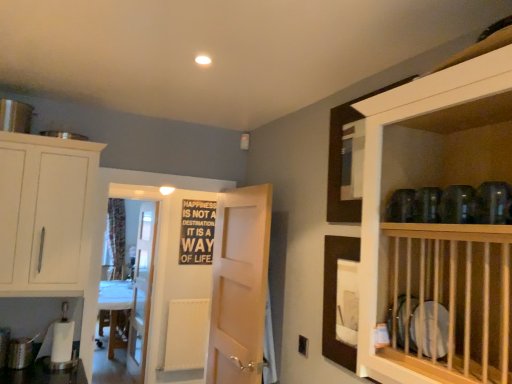
The height and width of the screenshot is (384, 512). In order to click on black matte sign at center in this screenshot , I will do `click(197, 232)`.

What do you see at coordinates (142, 290) in the screenshot?
I see `white wooden door at center, acting as the first door starting from the back` at bounding box center [142, 290].

I want to click on floral fabric curtain at left, so [x=117, y=235].

Describe the element at coordinates (117, 311) in the screenshot. I see `white glossy table at center` at that location.

Describe the element at coordinates (239, 285) in the screenshot. This screenshot has height=384, width=512. I see `white wooden door at center, which is the second door from left to right` at that location.

You are a GUI agent. You are given a task and a screenshot of the screen. Output one action in this format:
    pyautogui.click(x=<x>, y=<y>)
    Task: Click on the black matte sign at center
    The image size is (512, 384).
    Given the screenshot: What is the action you would take?
    pyautogui.click(x=197, y=232)

Are white glossy table at center and white wooden door at center, the first door when ordered from front to back, located far from each other?

That's right, there is a large distance between white glossy table at center and white wooden door at center, the first door when ordered from front to back.

From the image's perspective, is white glossy table at center on top of white wooden door at center, which appears as the first door when viewed from the right?

Incorrect, from the image's perspective, white glossy table at center is lower than white wooden door at center, which appears as the first door when viewed from the right.

Considering the relative sizes of white glossy table at center and white wooden door at center, which appears as the first door when viewed from the right, in the image provided, is white glossy table at center wider than white wooden door at center, which appears as the first door when viewed from the right,?

Yes.

Looking at this image, does white glossy table at center turn towards white wooden door at center, which is the second door from left to right?

No, white glossy table at center is not facing towards white wooden door at center, which is the second door from left to right.

Is white wooden door at center, which is the second door from left to right, touching floral fabric curtain at left?

They are not placed beside each other.

From a real-world perspective, is white wooden door at center, the first door when ordered from front to back, above or below floral fabric curtain at left?

white wooden door at center, the first door when ordered from front to back, is below floral fabric curtain at left.

Is point (240, 250) behind point (120, 254)?

No, it is in front of (120, 254).

Is white glossy table at center touching black matte sign at center?

No.

What's the angular difference between white glossy table at center and black matte sign at center's facing directions?

They differ by 90.9 degrees in their facing directions.

Considering the relative positions of white glossy table at center and black matte sign at center in the image provided, is white glossy table at center to the right of black matte sign at center from the viewer's perspective?

In fact, white glossy table at center is to the left of black matte sign at center.

Who is bigger, white glossy table at center or black matte sign at center?

white glossy table at center.

Could white glossy table at center be considered to be inside white wood cabinet at left?

That's incorrect, white glossy table at center is not inside white wood cabinet at left.

Is white glossy table at center at the back of white wood cabinet at left?

Yes, white wood cabinet at left is facing away from white glossy table at center.

This screenshot has height=384, width=512. In the image, there is a white wood cabinet at left. What are the coordinates of `counter below it (from a real-world perspective)` in the screenshot? It's located at (117, 311).

Is black matte sign at center located outside white wood cabinet at left?

Yes, black matte sign at center is not within white wood cabinet at left.

Is black matte sign at center at the right side of white wood cabinet at left?

Yes.

From the image's perspective, is black matte sign at center below white wood cabinet at left?

Correct, black matte sign at center appears lower than white wood cabinet at left in the image.

Where is `writing on the right of white wood cabinet at left`? Image resolution: width=512 pixels, height=384 pixels. writing on the right of white wood cabinet at left is located at coordinates (197, 232).

From the picture: Relative to white wooden door at center, the 2th door in the right-to-left sequence, is white wood cabinet at left in front or behind?

white wood cabinet at left is positioned closer to the viewer than white wooden door at center, the 2th door in the right-to-left sequence.

Considering the positions of point (72, 147) and point (153, 268), is point (72, 147) closer or farther from the camera than point (153, 268)?

Point (72, 147) is positioned closer to the camera compared to point (153, 268).

The width and height of the screenshot is (512, 384). Identify the location of the 2nd door positioned below the white wood cabinet at left (from the image's perspective). (142, 290).

How different are the orientations of white wood cabinet at left and white wooden door at center, the first door viewed from the left, in degrees?

The angle between the facing direction of white wood cabinet at left and the facing direction of white wooden door at center, the first door viewed from the left, is 88.3 degrees.

Can you confirm if white wooden door at center, which is the second door from left to right, is thinner than black matte sign at center?

No, white wooden door at center, which is the second door from left to right, is not thinner than black matte sign at center.

How far apart are white wooden door at center, the first door when ordered from front to back, and black matte sign at center?

1.95 meters.

The image size is (512, 384). I want to click on door that is the 1st object directly below the black matte sign at center (from a real-world perspective), so click(x=239, y=285).

Is point (232, 267) more distant than point (202, 202)?

No, it is in front of (202, 202).

Find the location of `door that is the 2nd one when counting forward from the white glossy table at center`. door that is the 2nd one when counting forward from the white glossy table at center is located at coordinates (239, 285).

Image resolution: width=512 pixels, height=384 pixels. In the image, there is a floral fabric curtain at left. Find the location of `door above it (from the image's perspective)`. door above it (from the image's perspective) is located at coordinates (239, 285).

From the picture: Estimate the real-world distances between objects in this image. Which object is further from white wooden door at center, acting as the first door starting from the back, white glossy table at center or white wooden door at center, the first door when ordered from front to back?

white wooden door at center, the first door when ordered from front to back, is positioned further to the anchor white wooden door at center, acting as the first door starting from the back.

Based on their spatial positions, is white wooden door at center, acting as the first door starting from the back, or white glossy table at center further from white wooden door at center, which is the second door from left to right?

white glossy table at center is further to white wooden door at center, which is the second door from left to right.

Based on their spatial positions, is white glossy table at center or white wooden door at center, the 2th door in the right-to-left sequence, closer to white wooden door at center, which appears as the first door when viewed from the right?

white wooden door at center, the 2th door in the right-to-left sequence, lies closer to white wooden door at center, which appears as the first door when viewed from the right, than the other object.

Estimate the real-world distances between objects in this image. Which object is further from black matte sign at center, floral fabric curtain at left or white wood cabinet at left?

Among the two, white wood cabinet at left is located further to black matte sign at center.

When comparing their distances from white glossy table at center, does white wooden door at center, the first door when ordered from front to back, or black matte sign at center seem further?

Among the two, white wooden door at center, the first door when ordered from front to back, is located further to white glossy table at center.

Considering their positions, is black matte sign at center positioned closer to white wooden door at center, the 2th door in the right-to-left sequence, than white wooden door at center, the first door when ordered from front to back?

The object closer to white wooden door at center, the 2th door in the right-to-left sequence, is black matte sign at center.

Looking at the image, which one is located further to black matte sign at center, white glossy table at center or floral fabric curtain at left?

The object further to black matte sign at center is floral fabric curtain at left.

Which object lies nearer to the anchor point white glossy table at center, black matte sign at center or white wooden door at center, acting as the first door starting from the back?

white wooden door at center, acting as the first door starting from the back, is positioned closer to the anchor white glossy table at center.

Find the location of a particular element. This screenshot has height=384, width=512. writing between white wooden door at center, which is the second door from left to right, and white glossy table at center from front to back is located at coordinates (197, 232).

Where is `door between white wooden door at center, which appears as the first door when viewed from the right, and floral fabric curtain at left in the front-back direction`? This screenshot has height=384, width=512. door between white wooden door at center, which appears as the first door when viewed from the right, and floral fabric curtain at left in the front-back direction is located at coordinates (142, 290).

Where is `writing positioned between white wood cabinet at left and floral fabric curtain at left from near to far`? writing positioned between white wood cabinet at left and floral fabric curtain at left from near to far is located at coordinates (197, 232).

The height and width of the screenshot is (384, 512). In order to click on writing located between white wood cabinet at left and white glossy table at center in the depth direction in this screenshot , I will do `click(197, 232)`.